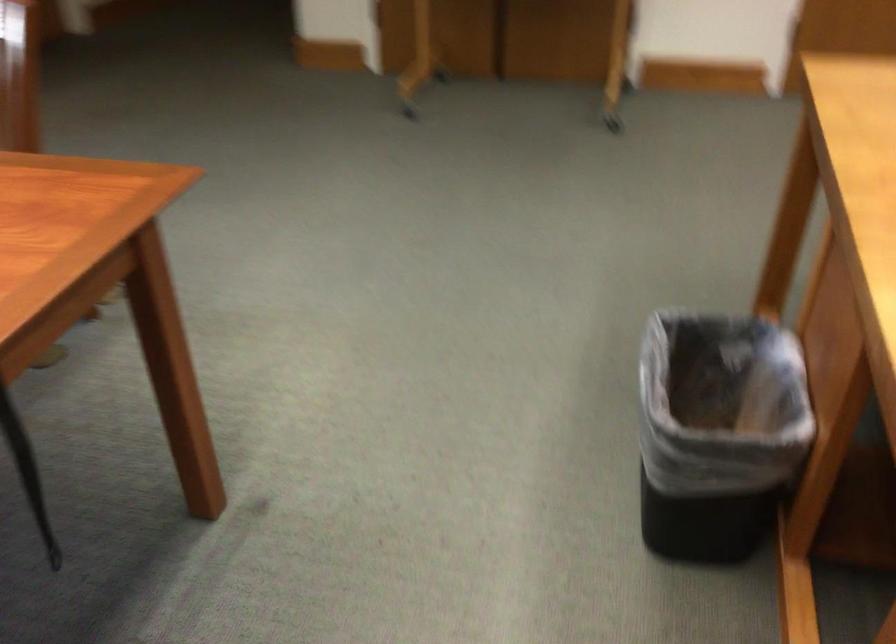
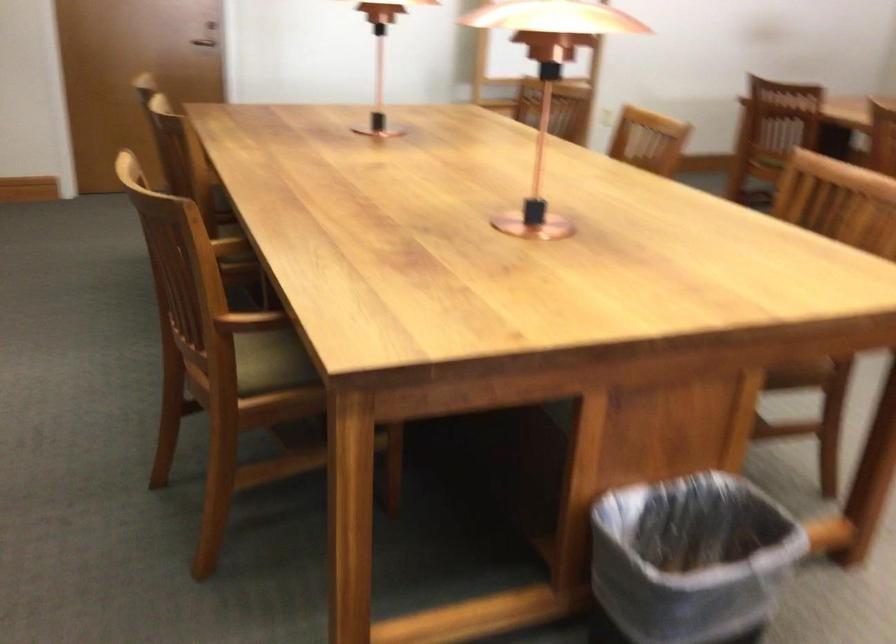
Find the pixel in the second image that matches [760,491] in the first image.

(691, 560)